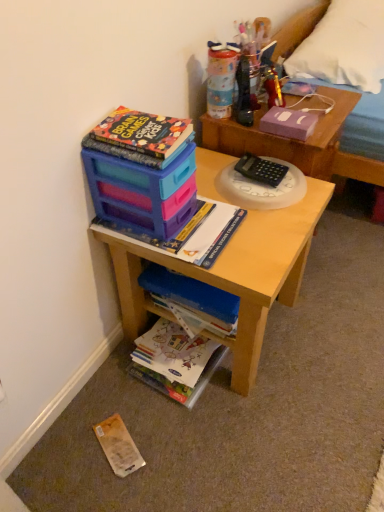
The width and height of the screenshot is (384, 512). What are the coordinates of `free space on the front side of matte plastic desk at center` in the screenshot? It's located at (214, 442).